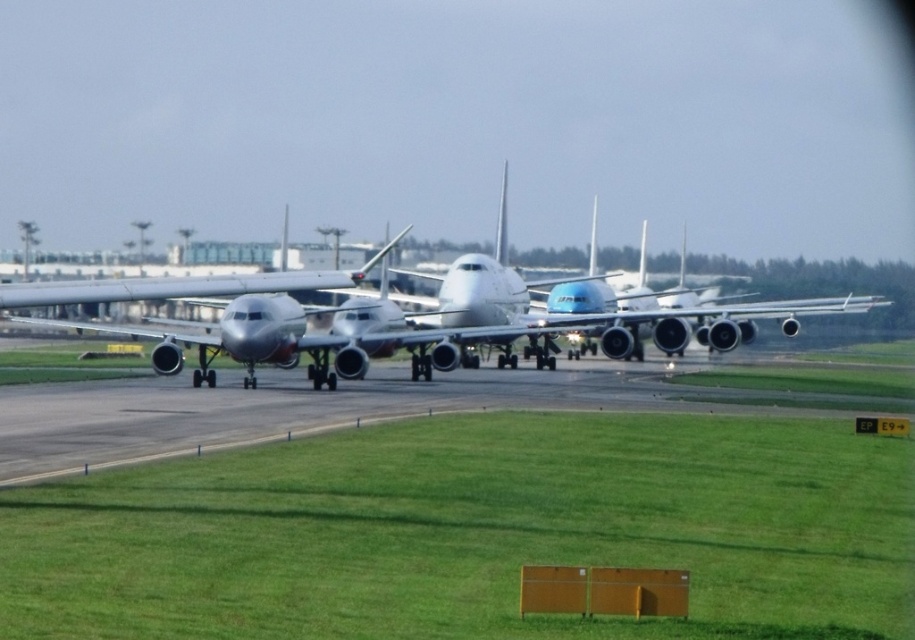
Question: Which object is farther from the camera taking this photo?

Choices:
 (A) green grass at lower center
 (B) metallic silver airplane at center

Answer: (B)

Question: Does green grass at lower center appear on the left side of metallic silver airplane at center?

Choices:
 (A) yes
 (B) no

Answer: (A)

Question: Is green grass at lower center in front of metallic silver airplane at center?

Choices:
 (A) no
 (B) yes

Answer: (B)

Question: Can you confirm if green grass at lower center is positioned below metallic silver airplane at center?

Choices:
 (A) no
 (B) yes

Answer: (B)